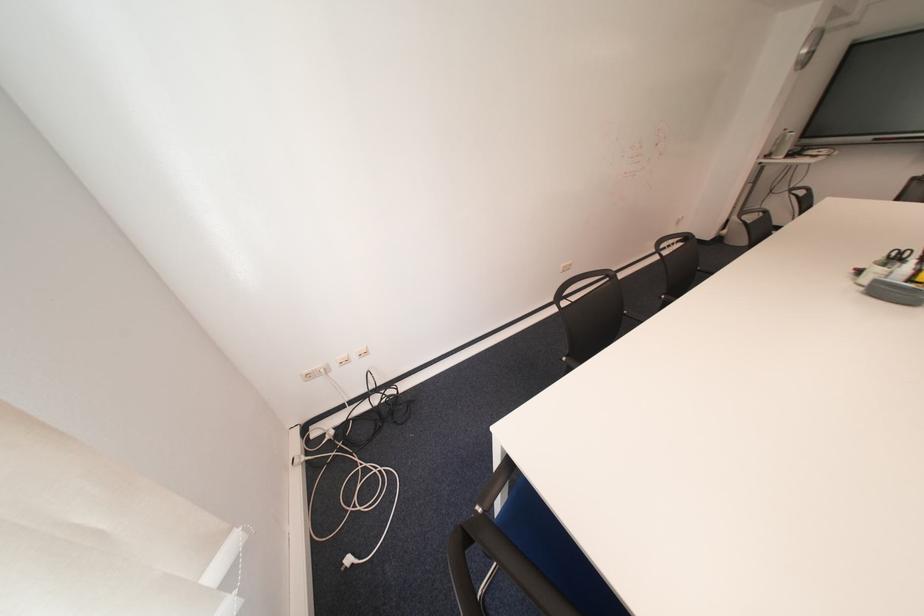
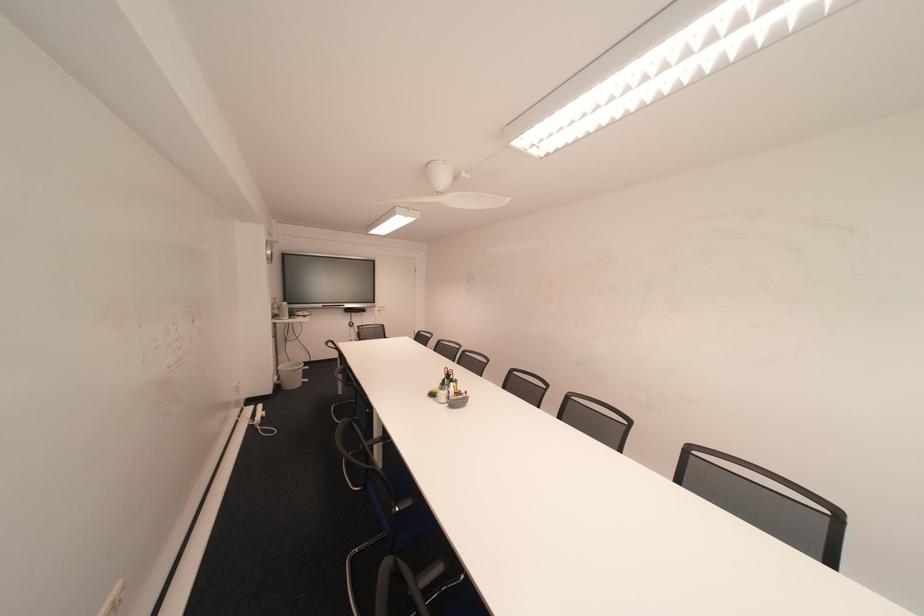
Where in the second image is the point corresponding to the point at 732,240 from the first image?

(288, 387)